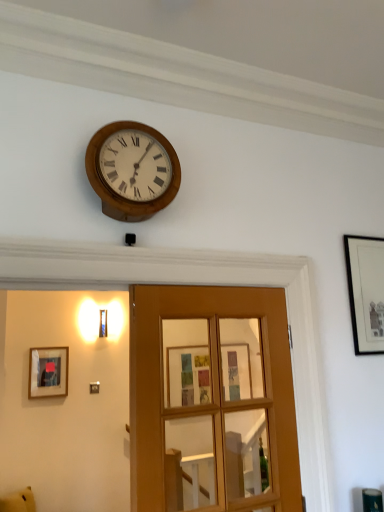
What is the approximate height of matte black picture frame at left, which is the first picture frame from back to front?

It is 16.72 inches.

What do you see at coordinates (366, 292) in the screenshot? I see `black matte picture frame at upper right, which is the first picture frame from front to back` at bounding box center [366, 292].

Locate an element on the screen. matte black picture frame at left, placed as the second picture frame when sorted from front to back is located at coordinates (48, 372).

You are a GUI agent. You are given a task and a screenshot of the screen. Output one action in this format:
    pyautogui.click(x=<x>, y=<y>)
    Task: Click on the picture frame below the black matte picture frame at upper right, arranged as the 2th picture frame when viewed from the left (from a real-world perspective)
    
    Given the screenshot: What is the action you would take?
    pyautogui.click(x=48, y=372)

From a real-world perspective, between matte black picture frame at left, marked as the second picture frame in a top-to-bottom arrangement, and black matte picture frame at upper right, arranged as the 2th picture frame when viewed from the left, who is vertically lower?

matte black picture frame at left, marked as the second picture frame in a top-to-bottom arrangement, from a real-world perspective.

Are matte black picture frame at left, positioned as the first picture frame in left-to-right order, and black matte picture frame at upper right, arranged as the 2th picture frame when viewed from the left, far apart?

Yes, matte black picture frame at left, positioned as the first picture frame in left-to-right order, and black matte picture frame at upper right, arranged as the 2th picture frame when viewed from the left, are located far from each other.

Looking at this image, is matte black picture frame at left, which is counted as the first picture frame, starting from the bottom, situated inside black matte picture frame at upper right, which is the first picture frame from front to back, or outside?

matte black picture frame at left, which is counted as the first picture frame, starting from the bottom, exists outside the volume of black matte picture frame at upper right, which is the first picture frame from front to back.

Is wooden glass door at center turned away from matte black picture frame at left, marked as the second picture frame in a top-to-bottom arrangement?

That's right, wooden glass door at center is facing away from matte black picture frame at left, marked as the second picture frame in a top-to-bottom arrangement.

Considering the sizes of objects wooden glass door at center and matte black picture frame at left, which is the first picture frame from back to front, in the image provided, who is shorter, wooden glass door at center or matte black picture frame at left, which is the first picture frame from back to front,?

With less height is matte black picture frame at left, which is the first picture frame from back to front.

Locate an element on the screen. This screenshot has width=384, height=512. picture frame that is the 1st one above the wooden glass door at center (from a real-world perspective) is located at coordinates (48, 372).

From a real-world perspective, does wooden glass door at center sit lower than matte black picture frame at left, placed as the second picture frame when sorted from front to back?

Yes, from a real-world perspective, wooden glass door at center is under matte black picture frame at left, placed as the second picture frame when sorted from front to back.

Is matte black picture frame at left, which is the first picture frame from back to front, next to yellow plush toy at lower left and touching it?

No, matte black picture frame at left, which is the first picture frame from back to front, is not making contact with yellow plush toy at lower left.

From the image's perspective, is matte black picture frame at left, placed as the second picture frame when sorted from front to back, under yellow plush toy at lower left?

Actually, matte black picture frame at left, placed as the second picture frame when sorted from front to back, appears above yellow plush toy at lower left in the image.

Is matte black picture frame at left, which is counted as the first picture frame, starting from the bottom, outside of yellow plush toy at lower left?

Yes, matte black picture frame at left, which is counted as the first picture frame, starting from the bottom, is located beyond the bounds of yellow plush toy at lower left.

Which of these two, matte black picture frame at left, which is the first picture frame from back to front, or yellow plush toy at lower left, is wider?

yellow plush toy at lower left is wider.

Considering the sizes of yellow plush toy at lower left and black matte picture frame at upper right, arranged as the 2th picture frame when viewed from the left, in the image, is yellow plush toy at lower left bigger or smaller than black matte picture frame at upper right, arranged as the 2th picture frame when viewed from the left,?

Clearly, yellow plush toy at lower left is larger in size than black matte picture frame at upper right, arranged as the 2th picture frame when viewed from the left.

Is yellow plush toy at lower left not close to black matte picture frame at upper right, placed as the second picture frame when sorted from bottom to top?

Yes.

Does point (2, 505) appear closer or farther from the camera than point (379, 275)?

Point (2, 505) is farther from the camera than point (379, 275).

Is yellow plush toy at lower left to the left of black matte picture frame at upper right, which is counted as the 1th picture frame, starting from the right, from the viewer's perspective?

Correct, you'll find yellow plush toy at lower left to the left of black matte picture frame at upper right, which is counted as the 1th picture frame, starting from the right.

Is yellow plush toy at lower left at the right side of matte black picture frame at left, marked as the second picture frame in a top-to-bottom arrangement?

No.

Is yellow plush toy at lower left wider or thinner than matte black picture frame at left, which is the first picture frame from back to front?

Considering their sizes, yellow plush toy at lower left looks broader than matte black picture frame at left, which is the first picture frame from back to front.

Is yellow plush toy at lower left in contact with matte black picture frame at left, marked as the second picture frame in a top-to-bottom arrangement?

No, yellow plush toy at lower left is not with matte black picture frame at left, marked as the second picture frame in a top-to-bottom arrangement.

From a real-world perspective, which is physically above, yellow plush toy at lower left or matte black picture frame at left, which is counted as the first picture frame, starting from the bottom?

matte black picture frame at left, which is counted as the first picture frame, starting from the bottom, from a real-world perspective.

From the image's perspective, is black matte picture frame at upper right, placed as the second picture frame when sorted from bottom to top, over matte black picture frame at left, marked as the second picture frame in a top-to-bottom arrangement?

Yes.

How many degrees apart are the facing directions of black matte picture frame at upper right, which is the second picture frame from back to front, and matte black picture frame at left, positioned as the first picture frame in left-to-right order?

The angle between the facing direction of black matte picture frame at upper right, which is the second picture frame from back to front, and the facing direction of matte black picture frame at left, positioned as the first picture frame in left-to-right order, is 1.78 degrees.

Is black matte picture frame at upper right, arranged as the 2th picture frame when viewed from the left, taller than matte black picture frame at left, placed as the second picture frame when sorted from front to back?

Correct, black matte picture frame at upper right, arranged as the 2th picture frame when viewed from the left, is much taller as matte black picture frame at left, placed as the second picture frame when sorted from front to back.

Is point (353, 269) positioned behind point (56, 383)?

No, it is in front of (56, 383).

Is wooden glass door at center not near yellow plush toy at lower left?

Yes.

Is wooden glass door at center wider than yellow plush toy at lower left?

In fact, wooden glass door at center might be narrower than yellow plush toy at lower left.

Could you tell me if wooden glass door at center is turned towards yellow plush toy at lower left?

No, wooden glass door at center is not aimed at yellow plush toy at lower left.

From a real-world perspective, is wooden glass door at center on top of yellow plush toy at lower left?

Yes.

Find the location of a particular element. picture frame below the black matte picture frame at upper right, the first picture frame from the top (from a real-world perspective) is located at coordinates (48, 372).

Locate an element on the screen. Image resolution: width=384 pixels, height=512 pixels. picture frame that is the 1st one above the wooden glass door at center (from a real-world perspective) is located at coordinates (48, 372).

Considering their positions, is matte black picture frame at left, which is the 2th picture frame from right to left, positioned further to wooden glass door at center than yellow plush toy at lower left?

Among the two, yellow plush toy at lower left is located further to wooden glass door at center.

When comparing their distances from yellow plush toy at lower left, does matte black picture frame at left, which is the 2th picture frame from right to left, or black matte picture frame at upper right, which is counted as the 1th picture frame, starting from the right, seem further?

black matte picture frame at upper right, which is counted as the 1th picture frame, starting from the right.

Based on their spatial positions, is wooden glass door at center or yellow plush toy at lower left further from black matte picture frame at upper right, the first picture frame from the top?

yellow plush toy at lower left is positioned further to the anchor black matte picture frame at upper right, the first picture frame from the top.

Which object lies further to the anchor point black matte picture frame at upper right, placed as the second picture frame when sorted from bottom to top, yellow plush toy at lower left or wooden glass door at center?

yellow plush toy at lower left is further to black matte picture frame at upper right, placed as the second picture frame when sorted from bottom to top.

Consider the image. Which object lies nearer to the anchor point wooden clock at upper center, wooden glass door at center or yellow plush toy at lower left?

Among the two, wooden glass door at center is located nearer to wooden clock at upper center.

When comparing their distances from wooden glass door at center, does yellow plush toy at lower left or black matte picture frame at upper right, which is the second picture frame from back to front, seem closer?

yellow plush toy at lower left.

When comparing their distances from yellow plush toy at lower left, does matte black picture frame at left, marked as the second picture frame in a top-to-bottom arrangement, or wooden clock at upper center seem closer?

matte black picture frame at left, marked as the second picture frame in a top-to-bottom arrangement, lies closer to yellow plush toy at lower left than the other object.

Based on their spatial positions, is yellow plush toy at lower left or wooden clock at upper center closer to black matte picture frame at upper right, which is the second picture frame from back to front?

wooden clock at upper center.

Find the location of `door between wooden clock at upper center and black matte picture frame at upper right, which is the second picture frame from back to front, in the horizontal direction`. door between wooden clock at upper center and black matte picture frame at upper right, which is the second picture frame from back to front, in the horizontal direction is located at coordinates (211, 400).

Locate an element on the screen. Image resolution: width=384 pixels, height=512 pixels. door located between matte black picture frame at left, which is counted as the first picture frame, starting from the bottom, and black matte picture frame at upper right, which is counted as the 1th picture frame, starting from the right, in the left-right direction is located at coordinates (211, 400).

Identify the location of door between yellow plush toy at lower left and black matte picture frame at upper right, the first picture frame from the top, from left to right. The width and height of the screenshot is (384, 512). (211, 400).

Locate an element on the screen. The width and height of the screenshot is (384, 512). door that lies between wooden clock at upper center and yellow plush toy at lower left from top to bottom is located at coordinates (211, 400).